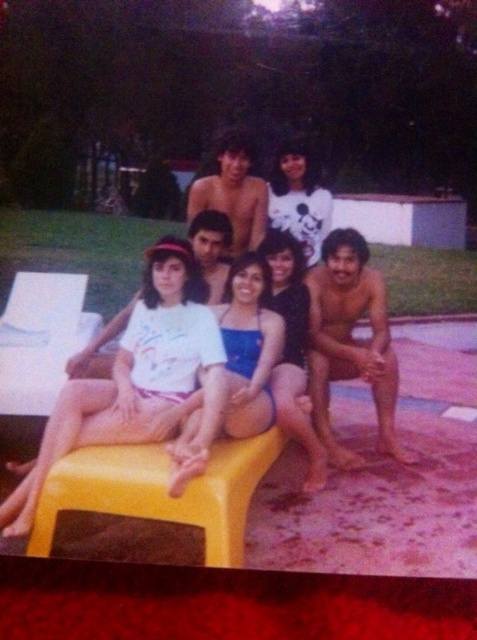
Question: Which point appears farthest from the camera in this image?

Choices:
 (A) (317, 189)
 (B) (186, 456)
 (C) (203, 289)
 (D) (290, 404)

Answer: (A)

Question: Can you confirm if white matte t-shirt at center is positioned to the left of matte black bikini top at center?

Choices:
 (A) no
 (B) yes

Answer: (B)

Question: Estimate the real-world distances between objects in this image. Which object is farther from the matte black bikini top at center?

Choices:
 (A) yellow plastic stool at center
 (B) white matte swimsuit at center
 (C) white cotton shirt at upper center
 (D) white matte t-shirt at center

Answer: (C)

Question: Does yellow plastic stool at center have a larger size compared to matte black bikini top at center?

Choices:
 (A) no
 (B) yes

Answer: (A)

Question: Among these objects, which one is farthest from the camera?

Choices:
 (A) yellow plastic stool at center
 (B) matte black bikini top at center
 (C) white matte swimsuit at center
 (D) white matte t-shirt at center

Answer: (B)

Question: From the image, what is the correct spatial relationship of yellow plastic stool at center in relation to matte black bikini top at center?

Choices:
 (A) left
 (B) right

Answer: (A)